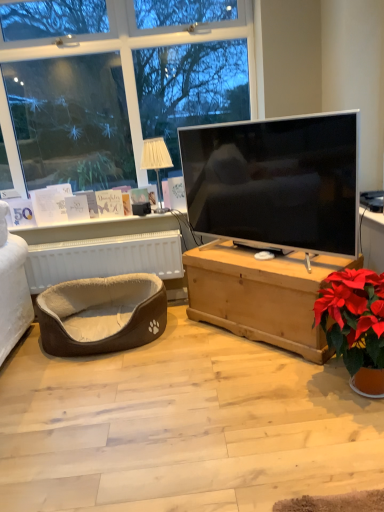
You are a GUI agent. You are given a task and a screenshot of the screen. Output one action in this format:
    pyautogui.click(x=<x>, y=<y>)
    Task: Click on the vacant space in front of light brown wooden chest at center
    This screenshot has height=512, width=384.
    Given the screenshot: What is the action you would take?
    pyautogui.click(x=253, y=401)